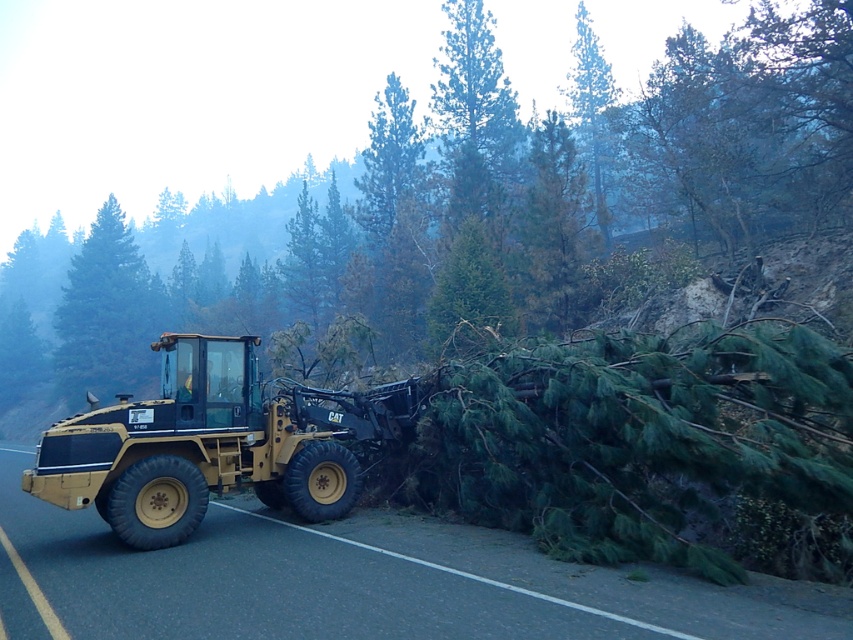
Question: Is green matte tree at left positioned before green needle-like at upper center?

Choices:
 (A) no
 (B) yes

Answer: (A)

Question: Which object is positioned closest to the green needle-like at upper center?

Choices:
 (A) matte yellow tractor at center
 (B) green matte tree at left

Answer: (A)

Question: Does yellow rubber truck at left have a lesser width compared to green needle-like at upper center?

Choices:
 (A) yes
 (B) no

Answer: (A)

Question: Can you confirm if green leafy tree at center is smaller than matte yellow tractor at center?

Choices:
 (A) no
 (B) yes

Answer: (A)

Question: Which of the following is the closest to the observer?

Choices:
 (A) green needle-like at upper center
 (B) green leafy tree at center
 (C) matte yellow tractor at center
 (D) green matte tree at left

Answer: (C)

Question: Which of the following is the closest to the observer?

Choices:
 (A) green needle-like at upper center
 (B) green matte tree at left
 (C) yellow rubber truck at left

Answer: (C)